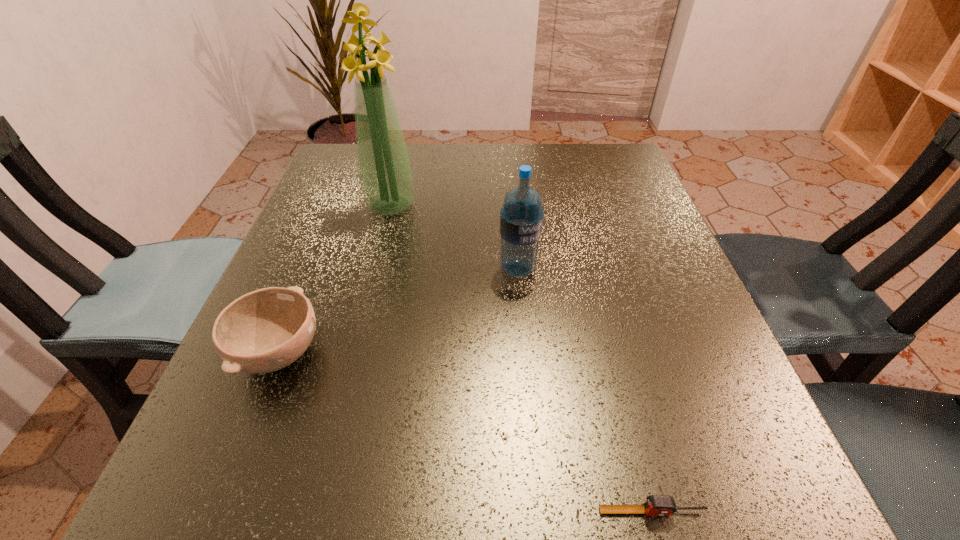
Where is `free spot that satisfies the following two spatial constraints: 1. on the front-facing side of the shortest object; 2. on the left side of the farthest object`? This screenshot has height=540, width=960. free spot that satisfies the following two spatial constraints: 1. on the front-facing side of the shortest object; 2. on the left side of the farthest object is located at coordinates (314, 511).